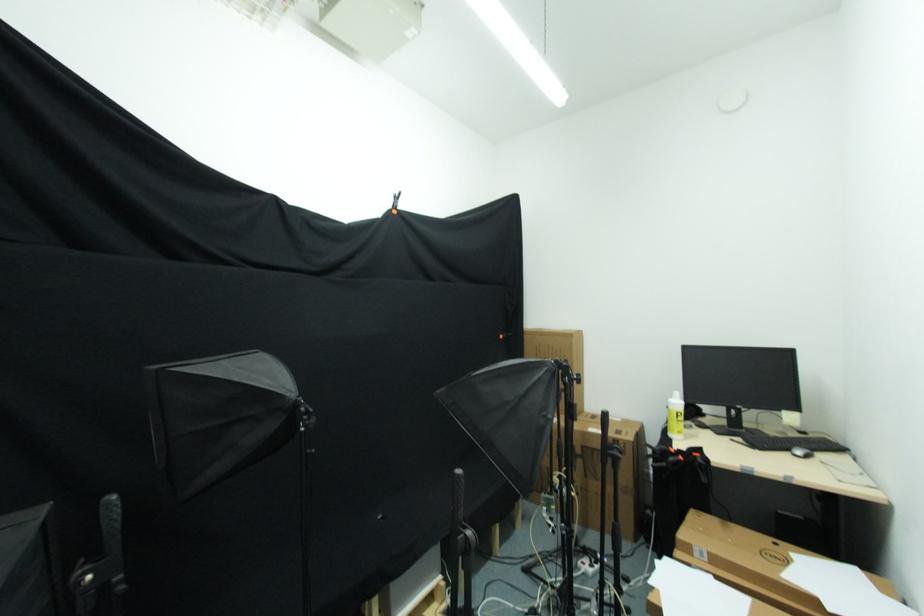
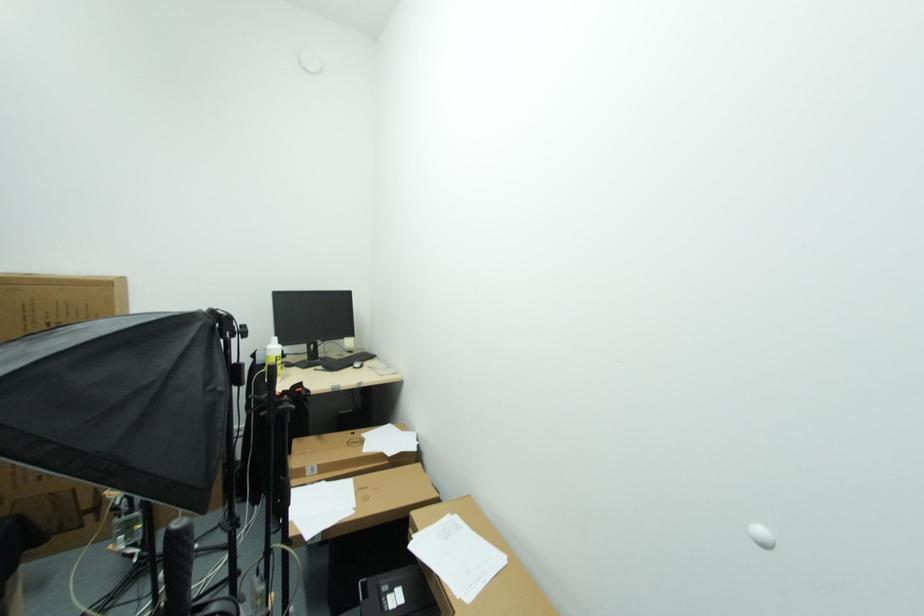
Question: How did the camera likely rotate?

Choices:
 (A) Left
 (B) Right
 (C) Up
 (D) Down

Answer: (B)